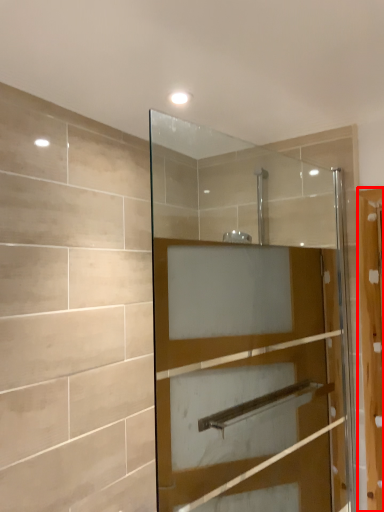
Question: In this image, where is screen door (annotated by the red box) located relative to door?

Choices:
 (A) left
 (B) right

Answer: (B)